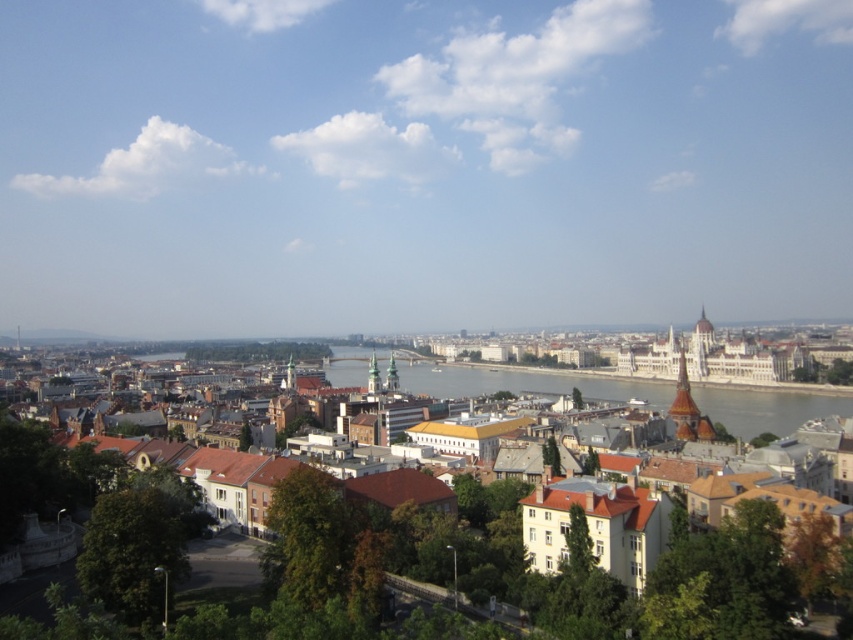
You are a tourist standing on the riverbank and want to take a photo that includes both the brown textured buildings at center and the greenish water at center. Based on their heights, which object will appear closer to the top of your photo?

The greenish water at center appears closer to the top of the photo because it is taller than the brown textured buildings at center.

You are a tourist standing on a bridge overlooking the city. You notice the brown textured buildings at center and the greenish water at center. Which of these two objects is closer to you according to the image?

The brown textured buildings at center are closer to you since they are positioned in front of the greenish water at center.